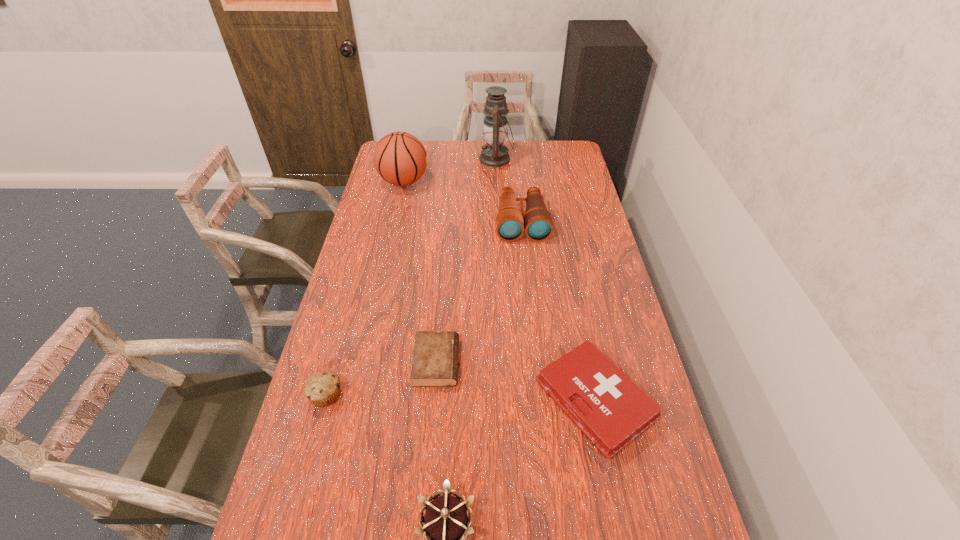
At what (x,y) coordinates should I click in order to perform the action: click on vacant area situated 0.230m on the right of the fifth tallest object. Please return your answer as a coordinate pair (x, y). Looking at the image, I should click on (427, 395).

Locate an element on the screen. The height and width of the screenshot is (540, 960). free space located 0.220m on the left of the first-aid kit is located at coordinates (455, 400).

Find the location of a particular element. The image size is (960, 540). vacant region located on the spine side of the shortest object is located at coordinates point(597,362).

The height and width of the screenshot is (540, 960). Find the location of `object located at the far edge`. object located at the far edge is located at coordinates (493, 154).

At what (x,y) coordinates should I click in order to perform the action: click on basketball located in the left edge section of the desktop. Please return your answer as a coordinate pair (x, y). The image size is (960, 540). Looking at the image, I should click on (400, 158).

Locate an element on the screen. muffin that is at the left edge is located at coordinates (323, 388).

What are the coordinates of `object that is at the right edge` in the screenshot? It's located at (611, 410).

This screenshot has width=960, height=540. In the image, there is a desktop. Identify the location of vacant space at the far edge. 517,143.

In the image, there is a desktop. Where is `free space at the left edge`? Image resolution: width=960 pixels, height=540 pixels. free space at the left edge is located at coordinates (379, 201).

At what (x,y) coordinates should I click in order to perform the action: click on free location at the right edge of the desktop. Please return your answer as a coordinate pair (x, y). This screenshot has width=960, height=540. Looking at the image, I should click on (582, 285).